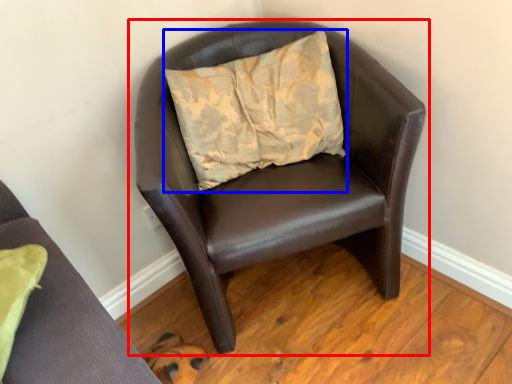
Question: Among these objects, which one is farthest to the camera, chair (highlighted by a red box) or pillow (highlighted by a blue box)?

Choices:
 (A) chair
 (B) pillow

Answer: (B)